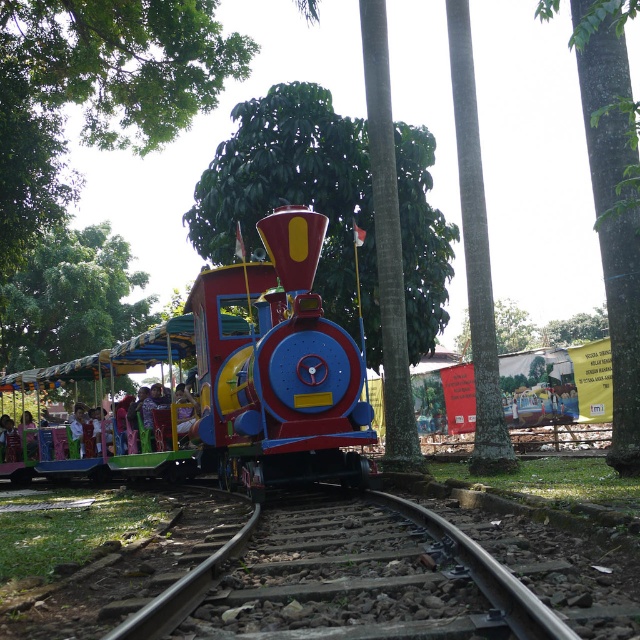
Does shiny metallic train at center have a lesser height compared to green leafy tree at upper center?

Indeed, shiny metallic train at center has a lesser height compared to green leafy tree at upper center.

At what (x,y) coordinates should I click in order to perform the action: click on shiny metallic train at center. Please return your answer as a coordinate pair (x, y). The image size is (640, 640). Looking at the image, I should click on (243, 376).

Between green leafy tree at upper left and green textured tree trunk at center, which one has more height?

With more height is green leafy tree at upper left.

Looking at this image, is green leafy tree at upper left to the left of green textured tree trunk at center from the viewer's perspective?

Yes, green leafy tree at upper left is to the left of green textured tree trunk at center.

Between point (61, 355) and point (490, 353), which one is positioned in front?

Point (490, 353) is more forward.

Where is `green leafy tree at upper left`? The width and height of the screenshot is (640, 640). green leafy tree at upper left is located at coordinates (70, 298).

Can you confirm if shiny metallic train at center is smaller than green leafy tree at center?

No, shiny metallic train at center is not smaller than green leafy tree at center.

From the picture: Is shiny metallic train at center bigger than green leafy tree at center?

Yes.

From the picture: Who is more distant from viewer, (236, 442) or (202, 193)?

Point (202, 193)

This screenshot has height=640, width=640. I want to click on shiny metallic train at center, so click(243, 376).